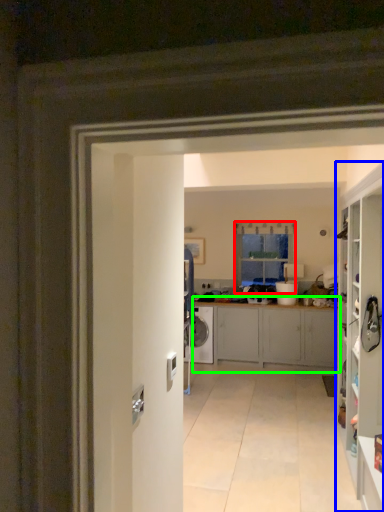
Question: Estimate the real-world distances between objects in this image. Which object is farther from window (highlighted by a red box), cabinetry (highlighted by a blue box) or cabinetry (highlighted by a green box)?

Choices:
 (A) cabinetry
 (B) cabinetry

Answer: (A)